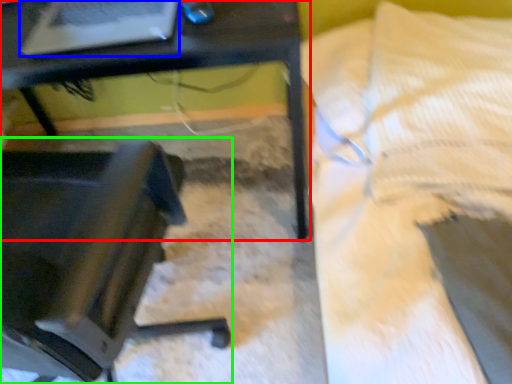
Question: Estimate the real-world distances between objects in this image. Which object is closer to table (highlighted by a red box), laptop (highlighted by a blue box) or chair (highlighted by a green box)?

Choices:
 (A) laptop
 (B) chair

Answer: (A)